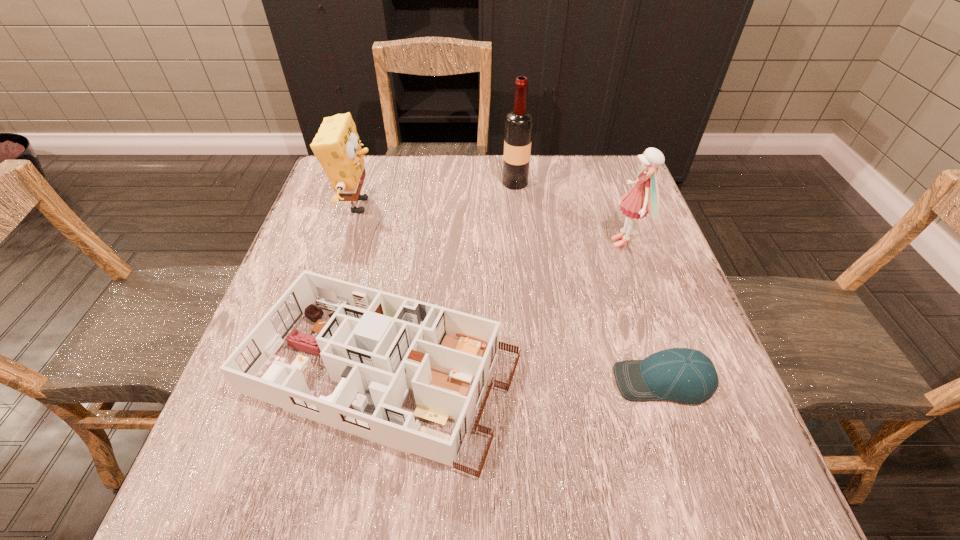
The height and width of the screenshot is (540, 960). Identify the location of free space between the baseball cap and the sponge. (511, 293).

Where is `free space between the sponge and the baseball cap`? free space between the sponge and the baseball cap is located at coordinates (511, 293).

In order to click on empty space between the dollhouse and the wine bottle in this screenshot , I will do `click(449, 279)`.

In order to click on free space between the dollhouse and the wine bottle in this screenshot , I will do `click(449, 279)`.

Select which object appears as the second closest to the sponge. Please provide its 2D coordinates. Your answer should be formatted as a tuple, i.e. [(x, y)], where the tuple contains the x and y coordinates of a point satisfying the conditions above.

[(519, 123)]

The width and height of the screenshot is (960, 540). I want to click on object that ranks as the third closest to the dollhouse, so click(644, 196).

Image resolution: width=960 pixels, height=540 pixels. In order to click on blank space that satisfies the following two spatial constraints: 1. on the front side of the wine bottle; 2. on the right side of the shortest object in this screenshot , I will do `click(535, 381)`.

At what (x,y) coordinates should I click in order to perform the action: click on free space that satisfies the following two spatial constraints: 1. on the face of the sponge; 2. on the right side of the baseball cap. Please return your answer as a coordinate pair (x, y). The image size is (960, 540). Looking at the image, I should click on (302, 381).

This screenshot has width=960, height=540. In order to click on free location that satisfies the following two spatial constraints: 1. on the face of the sponge; 2. on the right side of the baseball cap in this screenshot , I will do `click(302, 381)`.